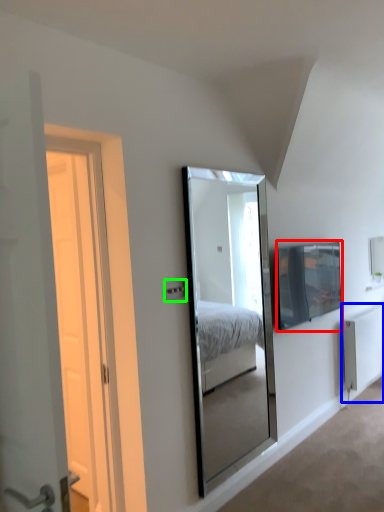
Question: Which is nearer to the television (highlighted by a red box)? radiator (highlighted by a blue box) or electric outlet (highlighted by a green box).

Choices:
 (A) radiator
 (B) electric outlet

Answer: (A)